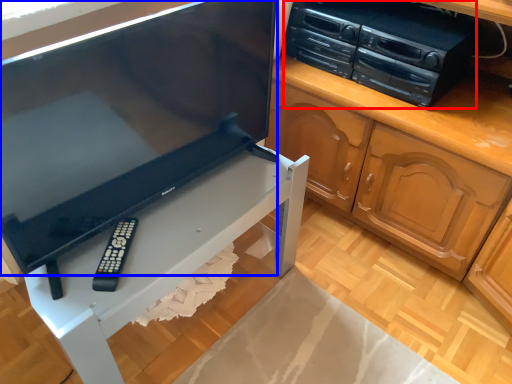
Question: Which point is closer to the camera, home appliance (highlighted by a red box) or television (highlighted by a blue box)?

Choices:
 (A) home appliance
 (B) television

Answer: (B)